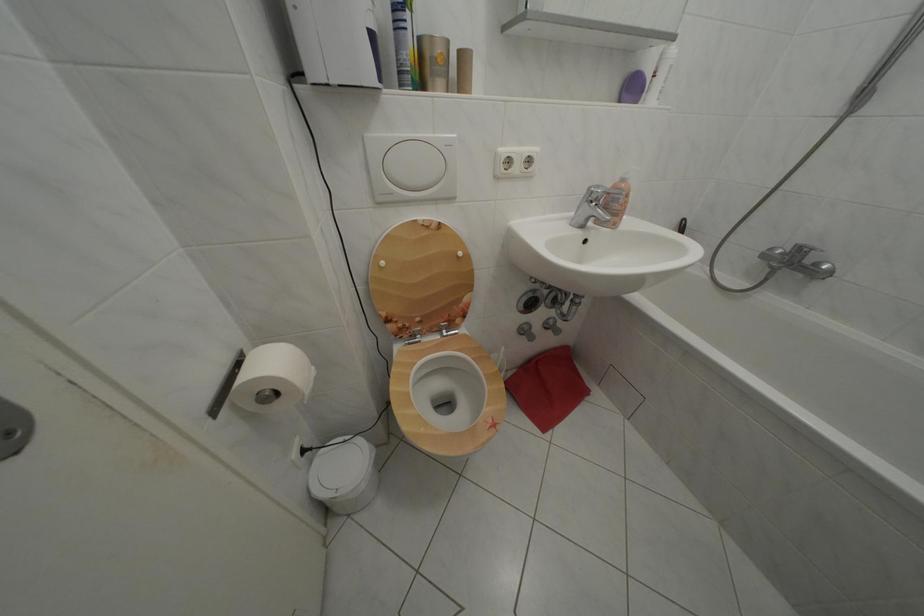
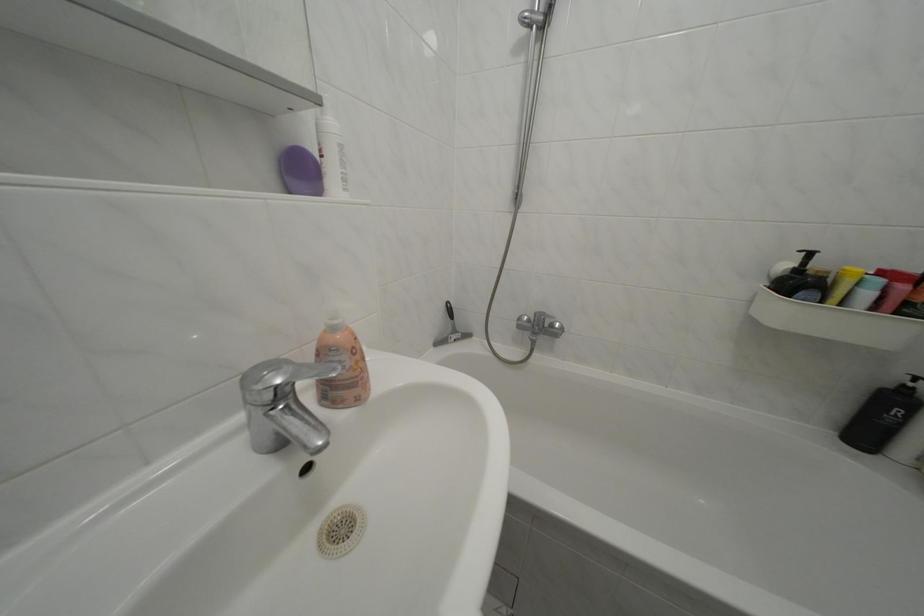
The point at (631, 187) is marked in the first image. Where is the corresponding point in the second image?

(342, 334)